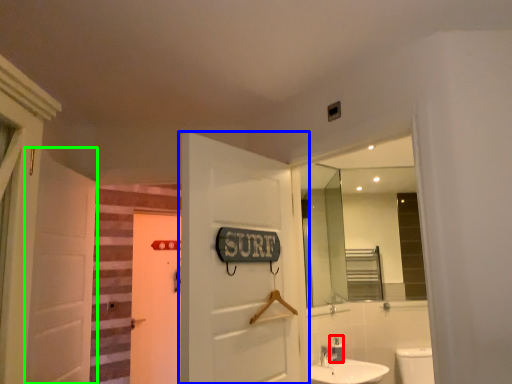
Question: Considering the real-world distances, which object is farthest from toiletry (highlighted by a red box)? door (highlighted by a blue box) or door (highlighted by a green box)?

Choices:
 (A) door
 (B) door

Answer: (B)